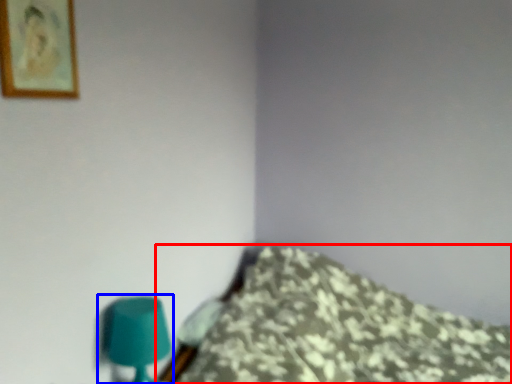
Question: Which point is further to the camera, furniture (highlighted by a red box) or table lamp (highlighted by a blue box)?

Choices:
 (A) furniture
 (B) table lamp

Answer: (B)